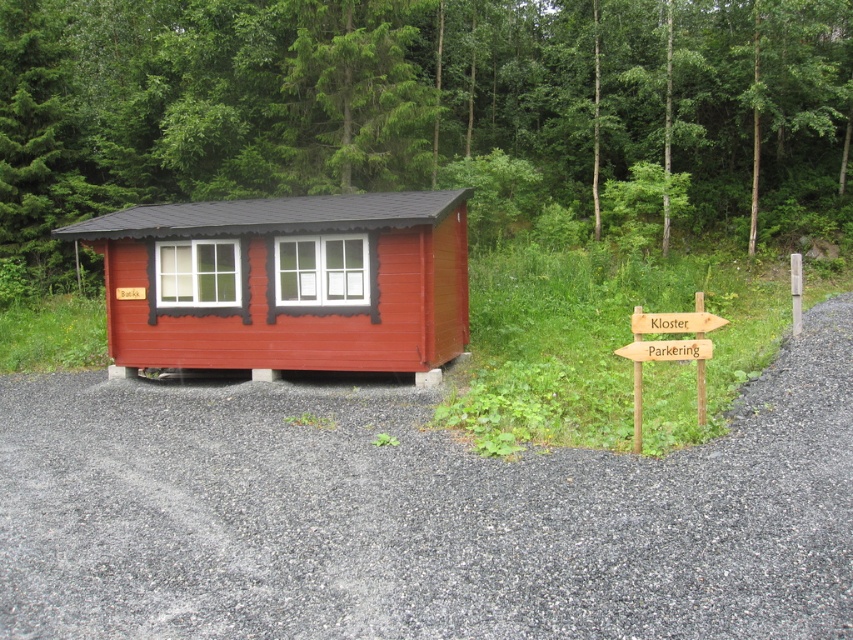
Between gray gravel driveway at lower center and matte wood cabin at center, which one appears on the right side from the viewer's perspective?

Positioned to the right is gray gravel driveway at lower center.

Does gray gravel driveway at lower center have a greater height compared to matte wood cabin at center?

In fact, gray gravel driveway at lower center may be shorter than matte wood cabin at center.

The width and height of the screenshot is (853, 640). What do you see at coordinates (419, 515) in the screenshot? I see `gray gravel driveway at lower center` at bounding box center [419, 515].

This screenshot has height=640, width=853. I want to click on gray gravel driveway at lower center, so click(x=419, y=515).

Between point (421, 592) and point (361, 106), which one is positioned behind?

Positioned behind is point (361, 106).

You are a GUI agent. You are given a task and a screenshot of the screen. Output one action in this format:
    pyautogui.click(x=<x>, y=<y>)
    Task: Click on the gray gravel driveway at lower center
    
    Given the screenshot: What is the action you would take?
    pyautogui.click(x=419, y=515)

Image resolution: width=853 pixels, height=640 pixels. What are the coordinates of `gray gravel driveway at lower center` in the screenshot? It's located at (419, 515).

Between gray gravel driveway at lower center and wooden signpost at lower right, which one has less height?

Standing shorter between the two is wooden signpost at lower right.

Can you confirm if gray gravel driveway at lower center is bigger than wooden signpost at lower right?

Correct, gray gravel driveway at lower center is larger in size than wooden signpost at lower right.

Is point (109, 403) in front of point (701, 406)?

No, (109, 403) is further to viewer.

The height and width of the screenshot is (640, 853). I want to click on gray gravel driveway at lower center, so point(419,515).